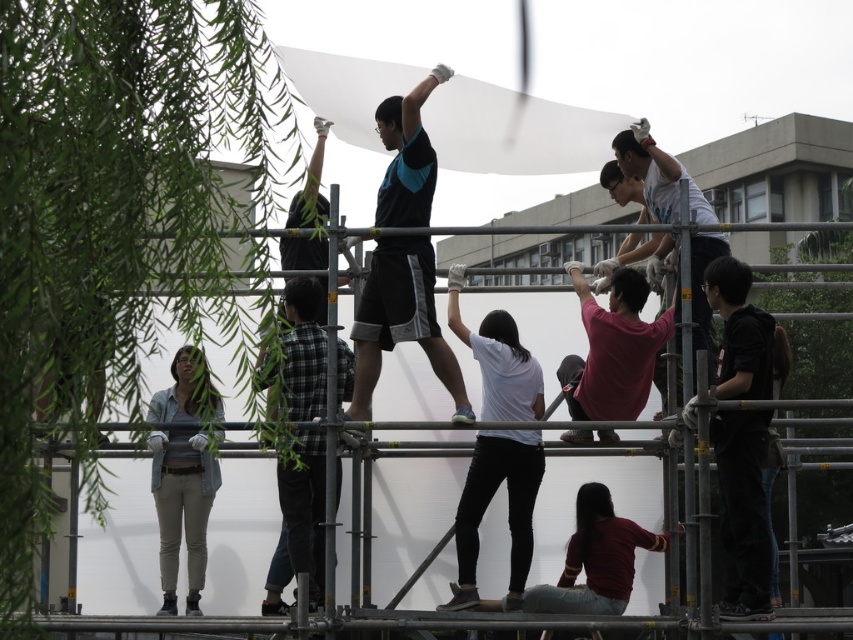
Question: Which object appears farthest from the camera in this image?

Choices:
 (A) plaid shirt at center
 (B) matte red shirt at center
 (C) black matte shorts at center

Answer: (B)

Question: Which point is closer to the camera taking this photo?

Choices:
 (A) (320, 292)
 (B) (460, 538)
 (C) (770, 609)
 (D) (177, 467)

Answer: (C)

Question: Does black matte shirt at lower right have a larger size compared to light blue shirt at upper right?

Choices:
 (A) no
 (B) yes

Answer: (A)

Question: Estimate the real-world distances between objects in this image. Which object is closer to the black matte shirt at lower right?

Choices:
 (A) plaid shirt at center
 (B) matte red shirt at center
 (C) light blue shirt at upper right
 (D) metallic scaffolding at center

Answer: (C)

Question: Can you confirm if black matte shirt at lower right is wider than plaid shirt at center?

Choices:
 (A) yes
 (B) no

Answer: (A)

Question: Is black matte shorts at center above white matte shirt at center?

Choices:
 (A) no
 (B) yes

Answer: (B)